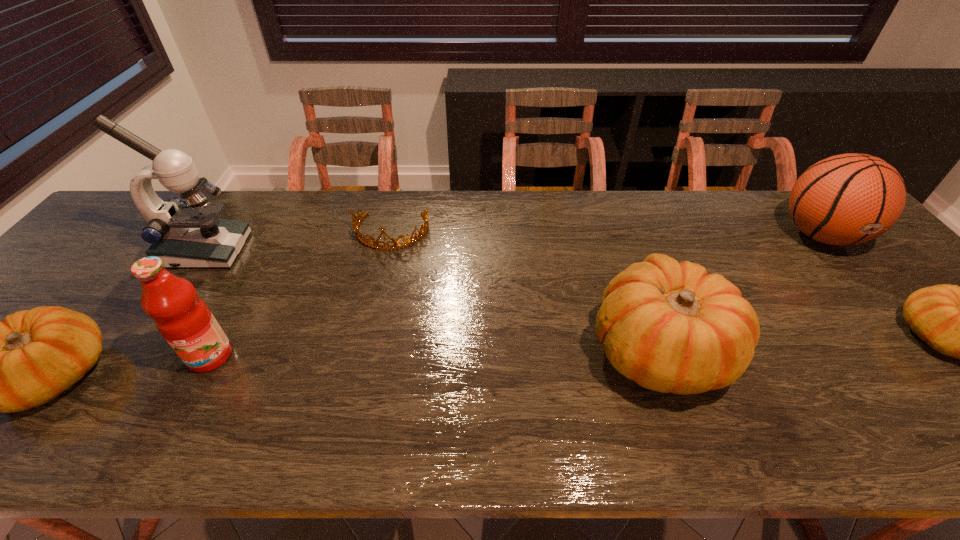
Locate an element on the screen. Image resolution: width=960 pixels, height=540 pixels. free point located 0.110m at the eyepiece of the tallest object is located at coordinates (282, 251).

Locate an element on the screen. free spot located on the front label of the third object from left to right is located at coordinates (186, 404).

Identify the location of tiara located in the far edge section of the desktop. (356, 223).

Locate an element on the screen. basketball situated at the far edge is located at coordinates (847, 199).

Locate an element on the screen. microscope located at the far edge is located at coordinates (183, 234).

Locate an element on the screen. gourd at the near edge is located at coordinates (671, 327).

Find the location of a particular element. This screenshot has width=960, height=540. fruit juice at the near edge is located at coordinates (184, 320).

I want to click on object that is at the right edge, so click(x=847, y=199).

Identify the location of object positioned at the far right corner. This screenshot has height=540, width=960. tap(847, 199).

You are a GUI agent. You are given a task and a screenshot of the screen. Output one action in this format:
    pyautogui.click(x=<x>, y=<y>)
    Task: Click on the blank space at the far edge
    This screenshot has height=540, width=960.
    Given the screenshot: What is the action you would take?
    pyautogui.click(x=716, y=218)